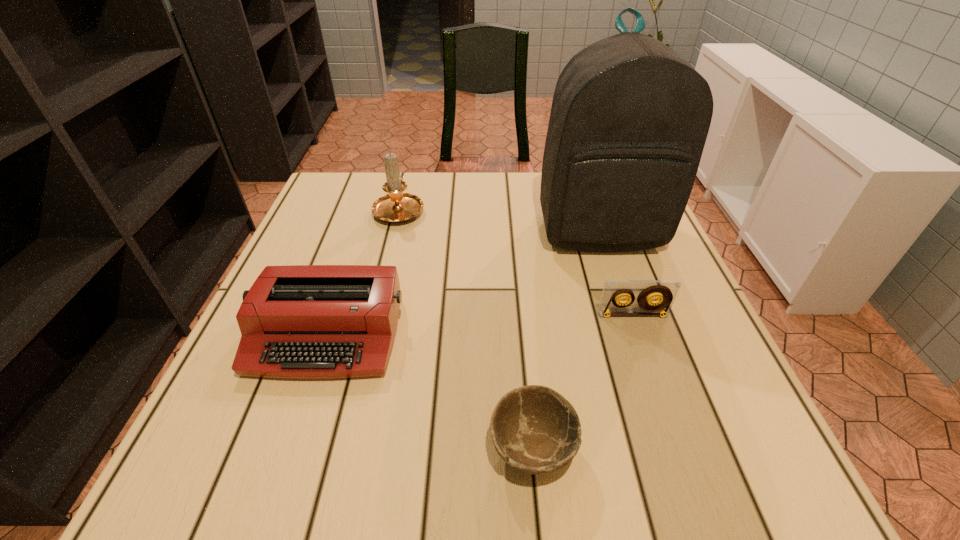
You are a GUI agent. You are given a task and a screenshot of the screen. Output one action in this format:
    pyautogui.click(x=<x>, y=<y>)
    Task: Click on the free spot between the shortest object and the backpack
    The image size is (960, 540).
    Given the screenshot: What is the action you would take?
    pyautogui.click(x=565, y=340)

Where is `free spot between the videotape and the bowl`? The height and width of the screenshot is (540, 960). free spot between the videotape and the bowl is located at coordinates (583, 382).

Locate an element on the screen. The image size is (960, 540). free point between the videotape and the tallest object is located at coordinates [x=616, y=274].

Where is `free spot between the fourth shortest object and the videotape`? The width and height of the screenshot is (960, 540). free spot between the fourth shortest object and the videotape is located at coordinates (516, 262).

You are a GUI agent. You are given a task and a screenshot of the screen. Output one action in this format:
    pyautogui.click(x=<x>, y=<y>)
    Task: Click on the vacant area between the tallest object and the second tallest object
    
    Given the screenshot: What is the action you would take?
    pyautogui.click(x=499, y=221)

Identify which object is located as the fourth nearest to the tallest object. Please provide its 2D coordinates. Your answer should be formatted as a tuple, i.e. [(x, y)], where the tuple contains the x and y coordinates of a point satisfying the conditions above.

[(534, 429)]

Select which object appears as the third closest to the candle. Please provide its 2D coordinates. Your answer should be formatted as a tuple, i.e. [(x, y)], where the tuple contains the x and y coordinates of a point satisfying the conditions above.

[(665, 291)]